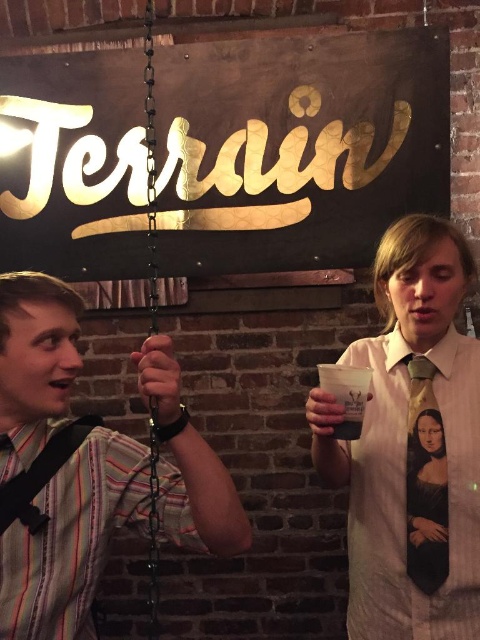
Question: Does matte green tie at center have a larger size compared to monet print silk tie at center?

Choices:
 (A) yes
 (B) no

Answer: (A)

Question: Observing the image, what is the correct spatial positioning of white silk shirt at center in reference to striped fabric shirt at left?

Choices:
 (A) below
 (B) above

Answer: (A)

Question: Among these points, which one is farthest from the camera?

Choices:
 (A) (336, 384)
 (B) (424, 440)
 (C) (434, 244)
 (D) (424, 440)

Answer: (C)

Question: Does white silk shirt at center appear over matte green tie at center?

Choices:
 (A) yes
 (B) no

Answer: (A)

Question: Which object appears farthest from the camera in this image?

Choices:
 (A) matte green tie at center
 (B) striped fabric shirt at left
 (C) monet print silk tie at center
 (D) matte plastic cup at center

Answer: (C)

Question: Which point is farther to the camera?

Choices:
 (A) white silk shirt at center
 (B) monet print silk tie at center

Answer: (B)